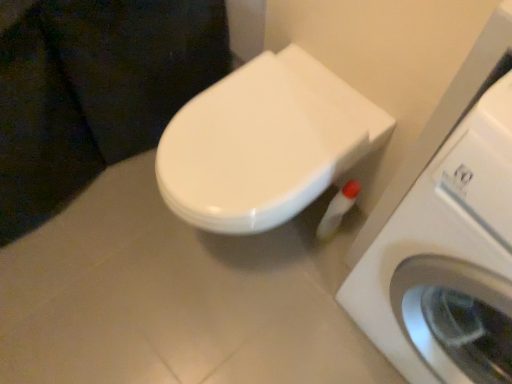
Identify the location of white plastic washing machine at right. (444, 254).

Locate an element on the screen. white glossy toilet at center is located at coordinates (264, 143).

The width and height of the screenshot is (512, 384). In order to click on white glossy toilet paper at lower right in this screenshot , I will do `click(337, 210)`.

Where is `white plastic washing machine at right`? white plastic washing machine at right is located at coordinates (444, 254).

From the image's perspective, who appears lower, white glossy toilet at center or white glossy toilet paper at lower right?

From the image's view, white glossy toilet paper at lower right is below.

Visually, is white glossy toilet at center positioned to the left or to the right of white glossy toilet paper at lower right?

white glossy toilet at center is to the left of white glossy toilet paper at lower right.

Where is `toilet paper that appears on the right of white glossy toilet at center`? toilet paper that appears on the right of white glossy toilet at center is located at coordinates (337, 210).

Between point (231, 141) and point (331, 237), which one is positioned behind?

Positioned behind is point (331, 237).

Is white plastic washing machine at right positioned with its back to white glossy toilet paper at lower right?

No, white plastic washing machine at right's orientation is not away from white glossy toilet paper at lower right.

Looking at this image, from a real-world perspective, is white plastic washing machine at right located beneath white glossy toilet paper at lower right?

Incorrect, from a real-world perspective, white plastic washing machine at right is higher than white glossy toilet paper at lower right.

Based on the photo, between white plastic washing machine at right and white glossy toilet paper at lower right, which one is positioned behind?

white glossy toilet paper at lower right is more distant.

Is white plastic washing machine at right in contact with white glossy toilet paper at lower right?

white plastic washing machine at right is not next to white glossy toilet paper at lower right, and they're not touching.

Is white glossy toilet at center beside white plastic washing machine at right?

There is a gap between white glossy toilet at center and white plastic washing machine at right.

Who is smaller, white glossy toilet at center or white plastic washing machine at right?

With smaller size is white glossy toilet at center.

Does white glossy toilet at center come behind white plastic washing machine at right?

Yes.

Which object is positioned more to the right, white glossy toilet at center or white plastic washing machine at right?

white plastic washing machine at right.

Can you confirm if white glossy toilet paper at lower right is wider than white plastic washing machine at right?

In fact, white glossy toilet paper at lower right might be narrower than white plastic washing machine at right.

Between white glossy toilet paper at lower right and white plastic washing machine at right, which one has more height?

Standing taller between the two is white plastic washing machine at right.

Is point (349, 206) behind point (499, 82)?

Yes, point (349, 206) is farther from viewer.

Between white plastic washing machine at right and white glossy toilet at center, which one has larger size?

white plastic washing machine at right.

From a real-world perspective, is white plastic washing machine at right positioned above or below white glossy toilet at center?

white plastic washing machine at right is situated higher than white glossy toilet at center in the real world.

You are a GUI agent. You are given a task and a screenshot of the screen. Output one action in this format:
    pyautogui.click(x=<x>, y=<y>)
    Task: Click on the toilet behind the white plastic washing machine at right
    The width and height of the screenshot is (512, 384).
    Given the screenshot: What is the action you would take?
    pyautogui.click(x=264, y=143)

From the image's perspective, would you say white plastic washing machine at right is positioned over white glossy toilet at center?

Actually, white plastic washing machine at right appears below white glossy toilet at center in the image.

Are white glossy toilet paper at lower right and white glossy toilet at center beside each other?

white glossy toilet paper at lower right is not next to white glossy toilet at center, and they're not touching.

Is white glossy toilet paper at lower right aimed at white glossy toilet at center?

No, white glossy toilet paper at lower right is not turned towards white glossy toilet at center.

Identify the location of toilet paper that is under the white glossy toilet at center (from a real-world perspective). The image size is (512, 384). (337, 210).

At what (x,y) coordinates should I click in order to perform the action: click on washing machine below the white glossy toilet paper at lower right (from the image's perspective). Please return your answer as a coordinate pair (x, y). This screenshot has width=512, height=384. Looking at the image, I should click on (444, 254).

Looking at the image, which one is located closer to white plastic washing machine at right, white glossy toilet paper at lower right or white glossy toilet at center?

white glossy toilet at center lies closer to white plastic washing machine at right than the other object.

Looking at this image, considering their positions, is white plastic washing machine at right positioned further to white glossy toilet paper at lower right than white glossy toilet at center?

Among the two, white plastic washing machine at right is located further to white glossy toilet paper at lower right.

Based on the photo, based on their spatial positions, is white glossy toilet at center or white plastic washing machine at right closer to white glossy toilet paper at lower right?

white glossy toilet at center.

From the image, which object appears to be farther from white glossy toilet at center, white plastic washing machine at right or white glossy toilet paper at lower right?

Among the two, white glossy toilet paper at lower right is located further to white glossy toilet at center.

Based on the photo, looking at the image, which one is located further to white plastic washing machine at right, white glossy toilet at center or white glossy toilet paper at lower right?

The object further to white plastic washing machine at right is white glossy toilet paper at lower right.

Based on their spatial positions, is white glossy toilet paper at lower right or white plastic washing machine at right further from white glossy toilet at center?

white glossy toilet paper at lower right.

Find the location of `toilet between white plastic washing machine at right and white glossy toilet paper at lower right in the front-back direction`. toilet between white plastic washing machine at right and white glossy toilet paper at lower right in the front-back direction is located at coordinates (264, 143).